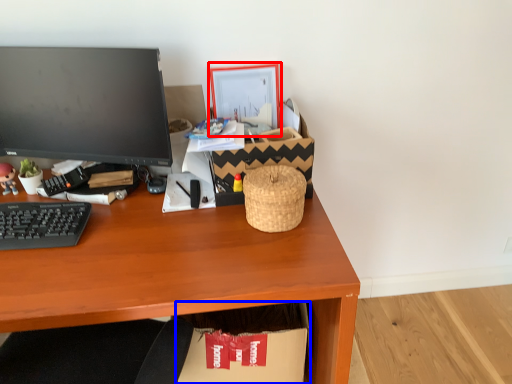
Question: Which object appears farthest to the camera in this image, picture frame (highlighted by a red box) or cardboard box (highlighted by a blue box)?

Choices:
 (A) picture frame
 (B) cardboard box

Answer: (A)